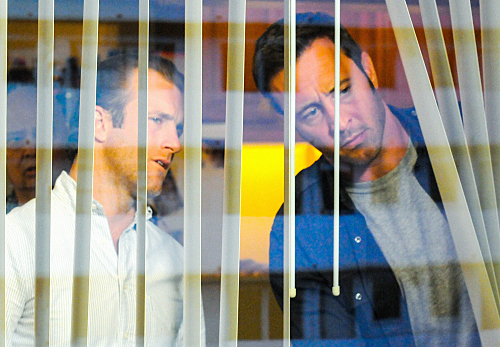
In order to click on blinds in this screenshot , I will do `click(495, 69)`, `click(472, 83)`, `click(446, 101)`, `click(430, 116)`, `click(287, 125)`, `click(236, 127)`, `click(193, 129)`, `click(142, 125)`, `click(85, 132)`, `click(44, 136)`.